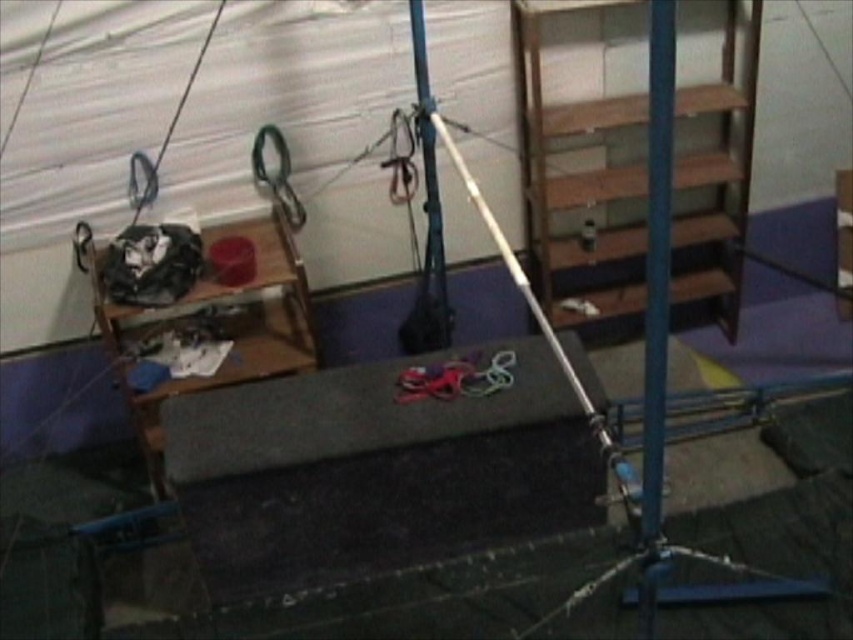
You are an athlete preparing for a training session. You need to place a 1.5 meter long foam roller between the wooden at left and the blue metallic pole at center. Considering their heights, will the foam roller fit vertically between them without touching the ceiling?

The wooden at left is taller than the blue metallic pole at center. Since the foam roller is 1.5 meters long, it might not fit vertically between them if the shorter pole is already close to that height. However, without specific height measurements, we can only assume based on the given comparison. If the pole is significantly shorter, there might be enough space. But since the wooden shelf is taller, the vertical clearance could be limited. The answer is inconclusive without exact dimensions.

You are organizing a gym and need to place a large equipment box that is 2 meters wide. You see the wooden at left and the blue metallic pole at center. Which object can the box fit next to without overlapping?

The wooden at left is bigger than the blue metallic pole at center, so the box can fit next to the wooden at left since it has more space available.